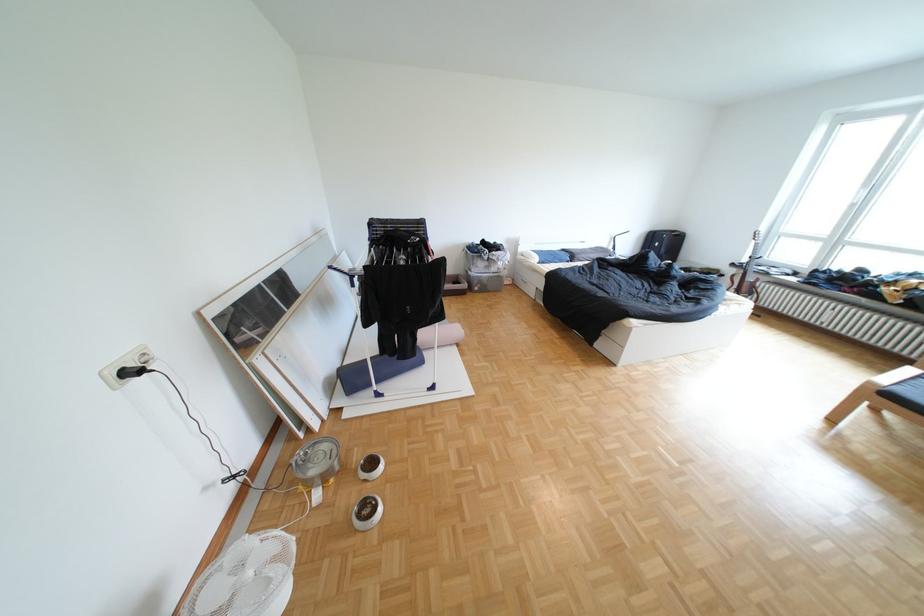
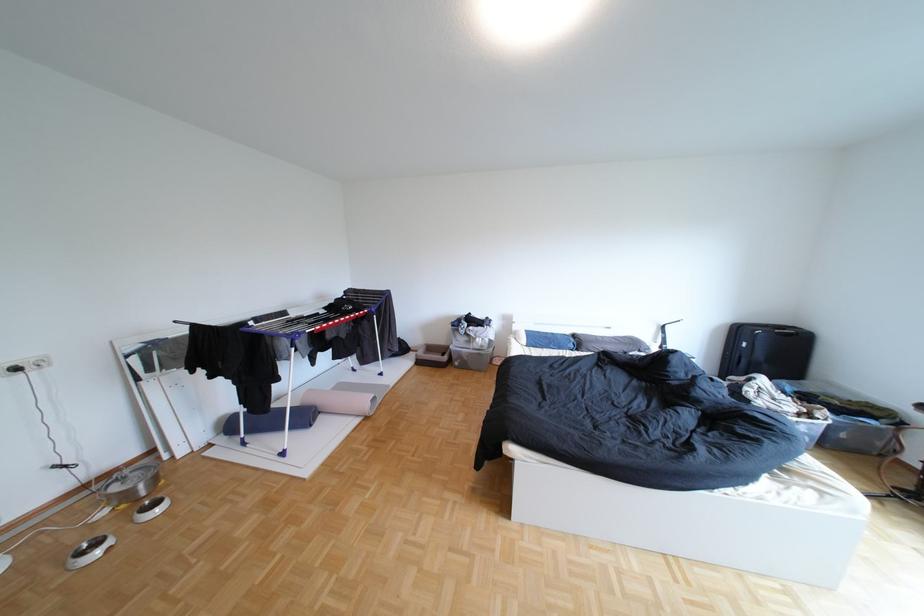
Find the pixel in the second image that matches the point at 578,251 in the first image.

(590, 336)